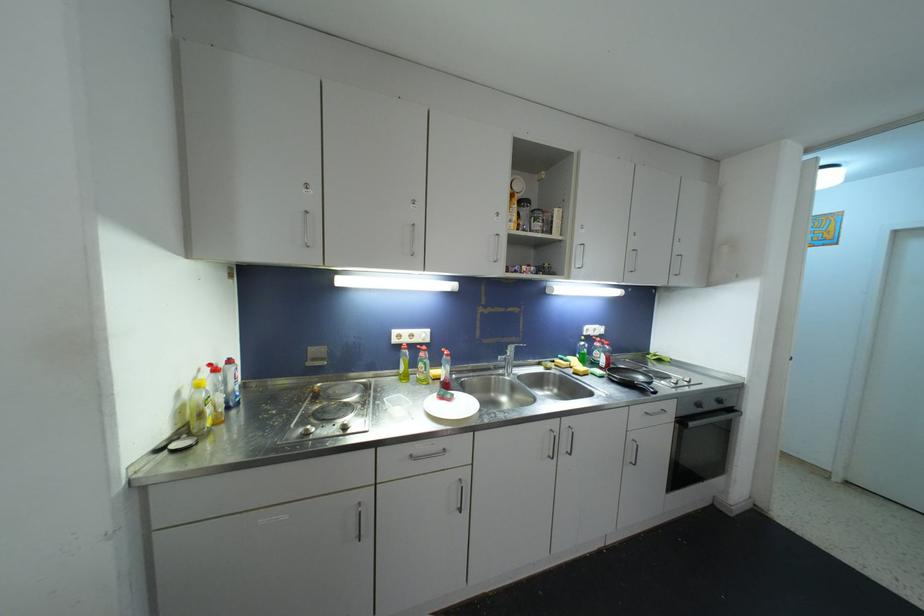
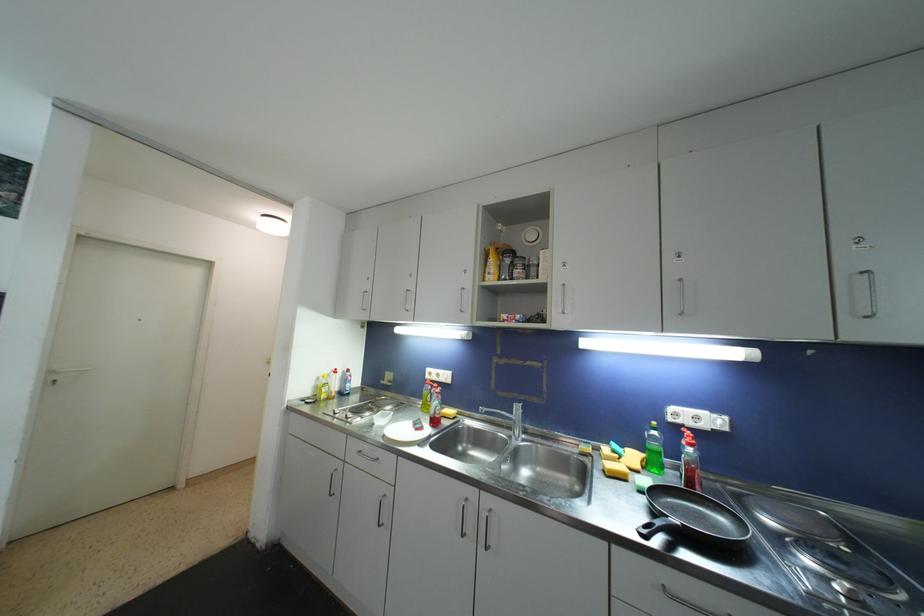
The point at (600, 336) is marked in the first image. Where is the corresponding point in the second image?

(708, 429)